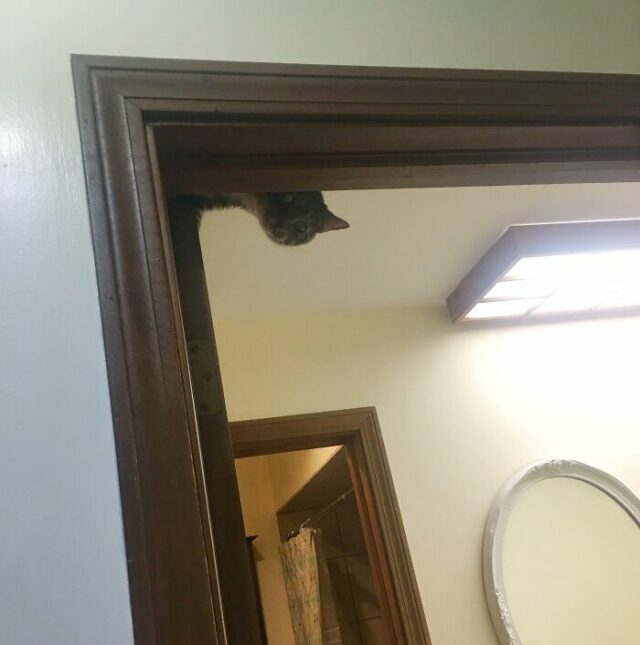
Identify the location of wood edge on ceiling fixture. (541, 235), (484, 266), (556, 318).